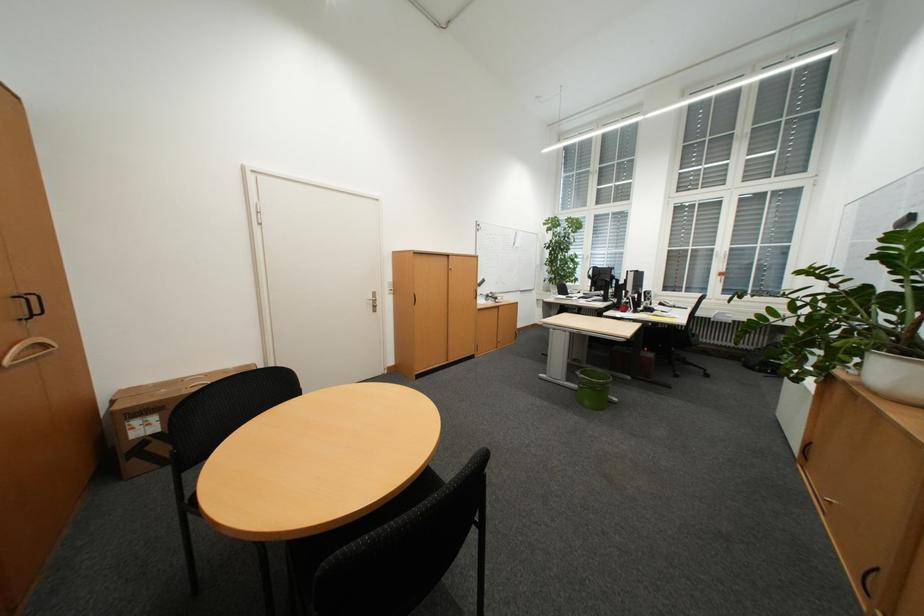
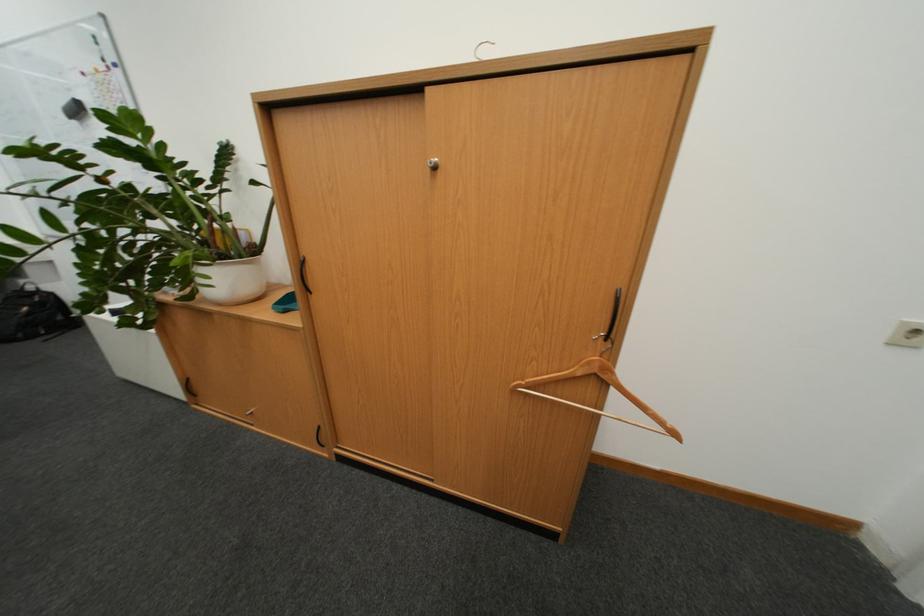
The images are taken continuously from a first-person perspective. In which direction is your viewpoint rotating?

The camera's rotation is toward right-down.